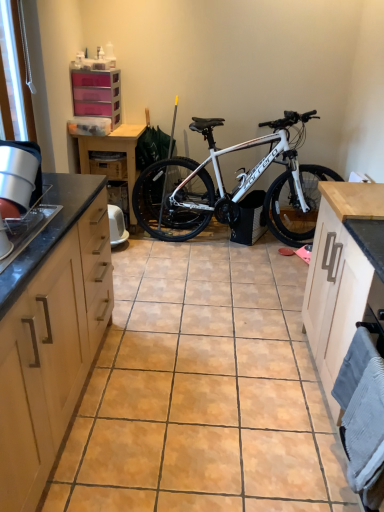
Question: From the image's perspective, is pink plastic drawers at upper left, the 3th cabinetry in the right-to-left sequence, positioned above or below wooden drawer at center?

Choices:
 (A) below
 (B) above

Answer: (B)

Question: Is pink plastic drawers at upper left, the 3th cabinetry when ordered from bottom to top, in front of or behind wooden drawer at center in the image?

Choices:
 (A) behind
 (B) front

Answer: (B)

Question: Estimate the real-world distances between objects in this image. Which object is farther from the white metallic bicycle at center?

Choices:
 (A) pink plastic drawers at upper left, the 1th cabinetry when ordered from top to bottom
 (B) wooden drawer at center
 (C) wooden table at center
 (D) light wood cabinet at right, positioned as the 1th cabinetry in right-to-left order
 (E) light wood cabinetry at left, the second cabinetry from the left

Answer: (E)

Question: Which object is positioned closest to the pink plastic drawers at upper left, the 3th cabinetry when ordered from bottom to top?

Choices:
 (A) light wood cabinet at right, which is the second cabinetry from back to front
 (B) wooden drawer at center
 (C) white metallic bicycle at center
 (D) light wood cabinetry at left, the second cabinetry from the left
 (E) wooden table at center

Answer: (E)